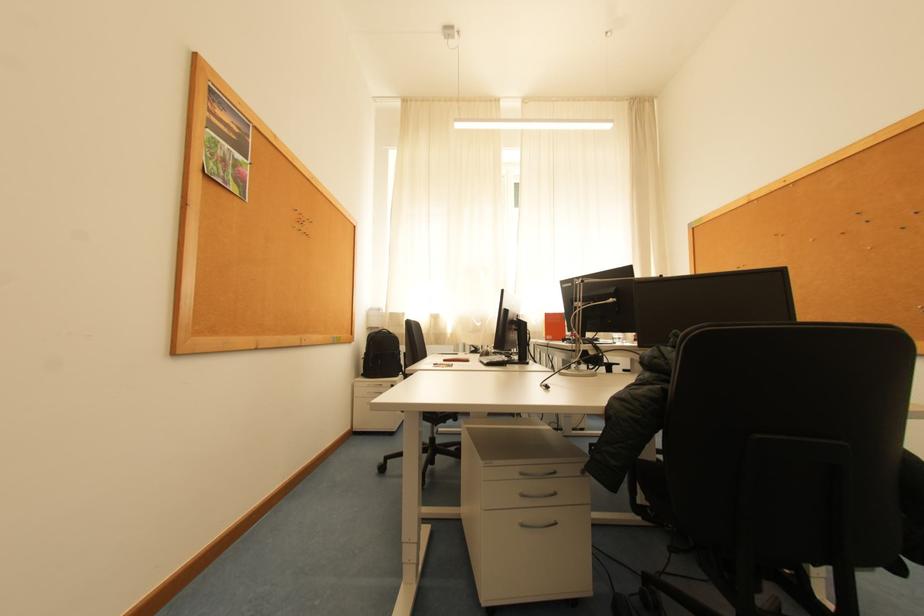
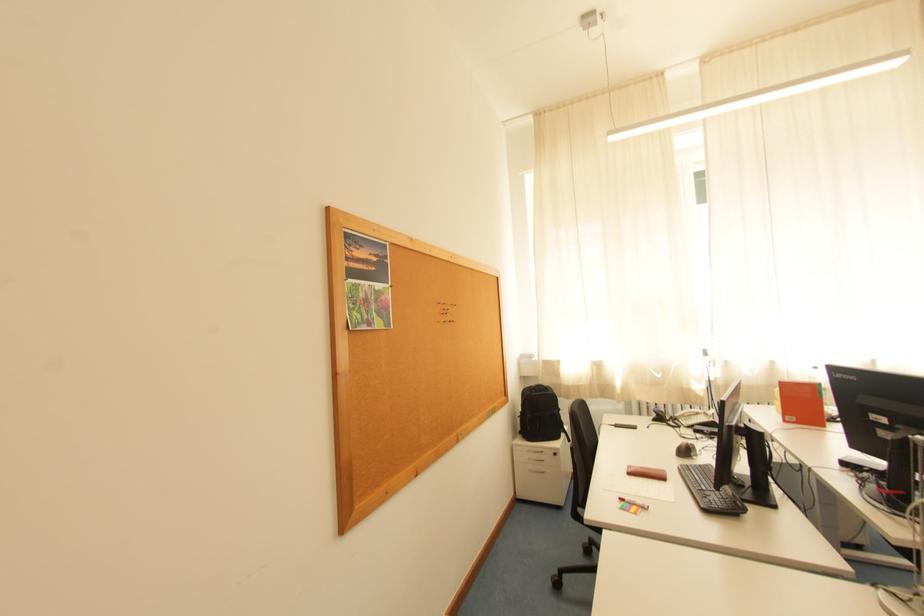
Question: Which direction would the cameraman need to move to produce the second image? Reply with the corresponding letter.

Choices:
 (A) Left
 (B) Right
 (C) Forward
 (D) Backward

Answer: (C)